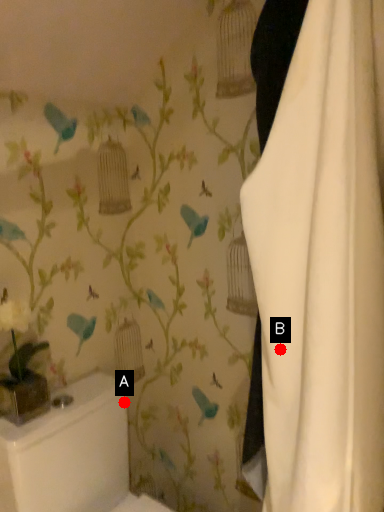
Question: Two points are circled on the image, labeled by A and B beside each circle. Which point appears farthest from the camera in this image?

Choices:
 (A) A is further
 (B) B is further

Answer: (A)